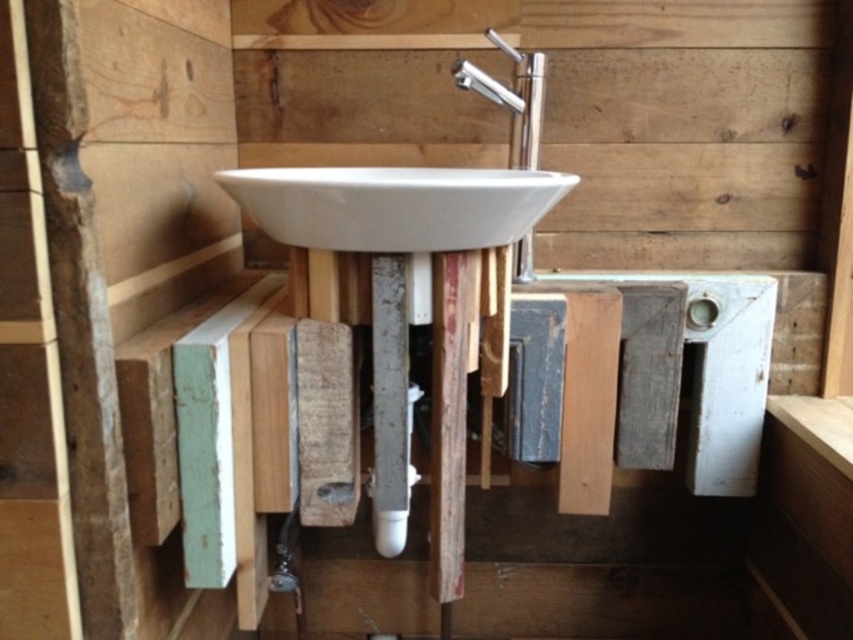
You are designing a bathroom layout and need to ensure proper spacing between the white glossy sink at center and the silver metallic faucet at upper center. Given their sizes, which one requires more space in the bathroom?

The white glossy sink at center requires more space because it is larger in size than the silver metallic faucet at upper center.

You are a plumber tasked with installing a new faucet. You have a silver metallic faucet at upper center that needs to be attached to the white glossy sink at center. Based on their sizes, will the faucet fit properly on the sink?

The white glossy sink at center might be wider than silver metallic faucet at upper center, so the faucet should fit properly as sinks are typically wider than faucets.

You are a plumber trying to fix a leak under the white glossy sink at center. The nearest tool you need is 36.85 inches away. Is the tool within arm reach if your maximum arm reach is 32 inches?

The tool is 36.85 inches away from the white glossy sink at center, which is beyond your maximum arm reach of 32 inches. You need to move closer or use a tool extender.